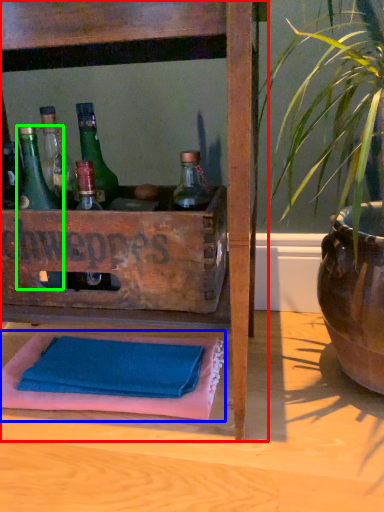
Question: Which object is the closest to the furniture (highlighted by a red box)? Choose among these: bath towel (highlighted by a blue box) or bottle (highlighted by a green box).

Choices:
 (A) bath towel
 (B) bottle

Answer: (B)